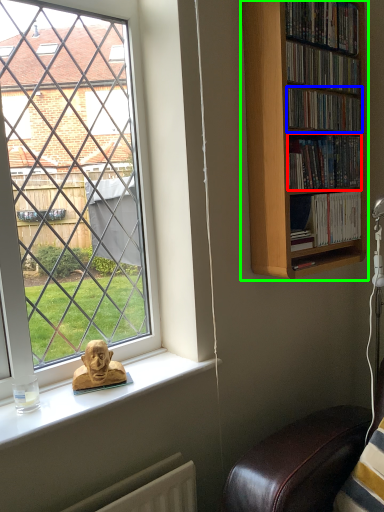
Question: Which object is the closest to the book (highlighted by a red box)? Choose among these: book (highlighted by a blue box) or bookcase (highlighted by a green box).

Choices:
 (A) book
 (B) bookcase

Answer: (A)